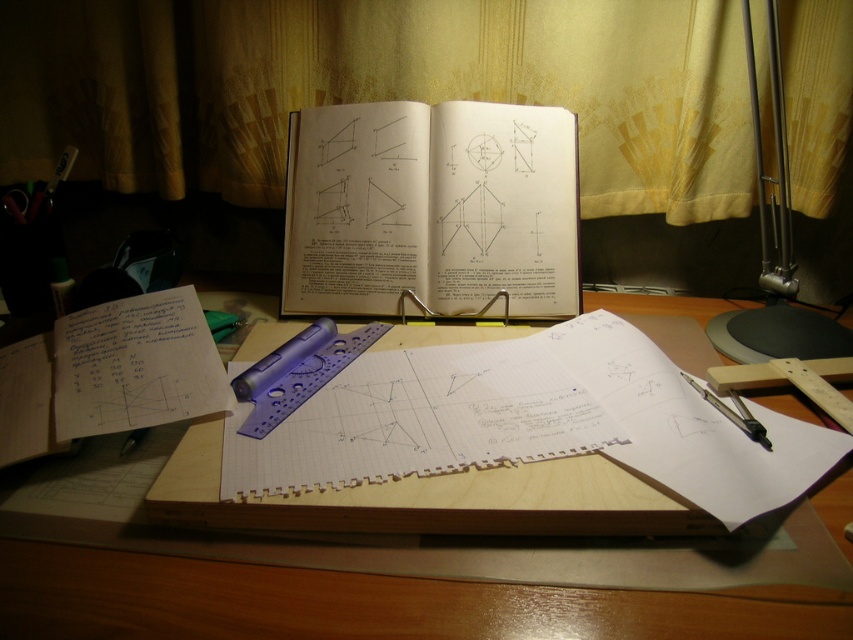
Question: Which object is farther from the camera taking this photo?

Choices:
 (A) wooden desk at center
 (B) white paper at center
 (C) metallic silver compass at lower right
 (D) metallic silver lamp at upper right

Answer: (B)

Question: Which object is closer to the camera taking this photo?

Choices:
 (A) metallic silver lamp at upper right
 (B) white paper at center
 (C) metallic silver compass at lower right

Answer: (C)

Question: Can you confirm if metallic silver lamp at upper right is thinner than metallic silver compass at lower right?

Choices:
 (A) yes
 (B) no

Answer: (B)

Question: Can you confirm if white paper at center is positioned to the right of metallic silver compass at lower right?

Choices:
 (A) yes
 (B) no

Answer: (B)

Question: Which of the following is the farthest from the observer?

Choices:
 (A) (483, 156)
 (B) (730, 412)
 (C) (831, 484)
 (D) (776, 176)

Answer: (D)

Question: Considering the relative positions of white paper at center and metallic silver lamp at upper right in the image provided, where is white paper at center located with respect to metallic silver lamp at upper right?

Choices:
 (A) right
 (B) left

Answer: (B)